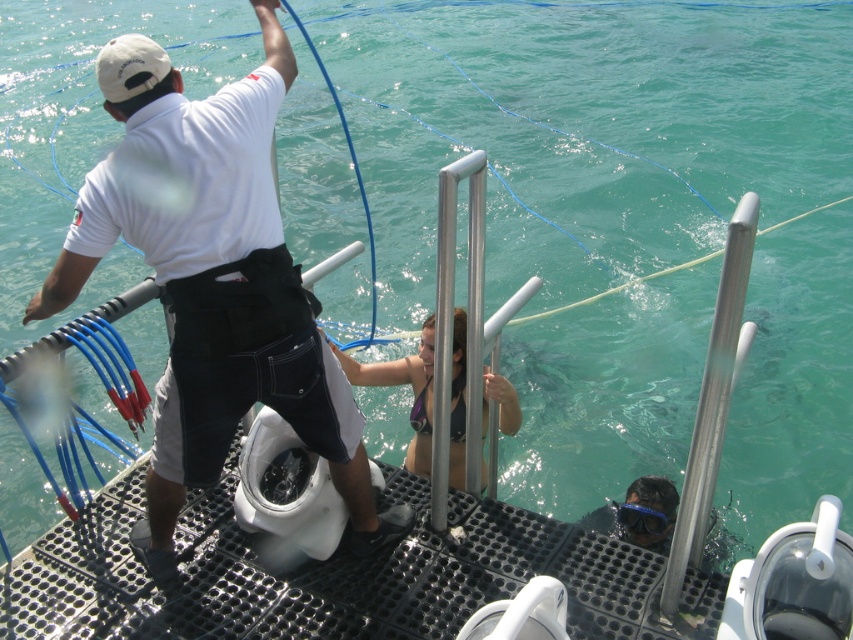
Who is lower down, white matte sailor at upper left or matte black bikini at center?

matte black bikini at center is lower down.

Can you confirm if white matte sailor at upper left is positioned above matte black bikini at center?

Yes.

Locate an element on the screen. Image resolution: width=853 pixels, height=640 pixels. white matte sailor at upper left is located at coordinates (213, 282).

At what (x,y) coordinates should I click in order to perform the action: click on white matte sailor at upper left. Please return your answer as a coordinate pair (x, y). Looking at the image, I should click on (213, 282).